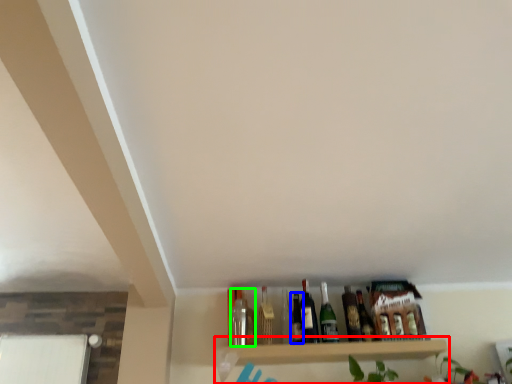
Question: Which object is positioned closest to shelf (highlighted by a red box)? Select from bottle (highlighted by a blue box) and bottle (highlighted by a green box).

Choices:
 (A) bottle
 (B) bottle

Answer: (A)